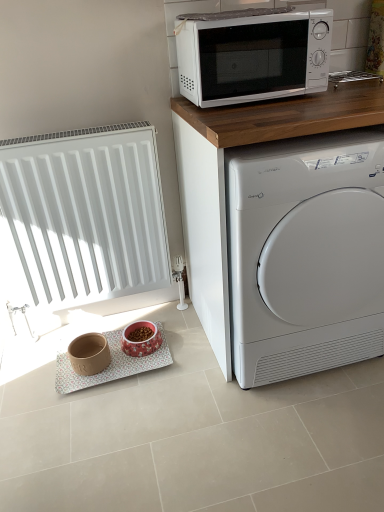
I want to click on free space that is to the left of white glossy washing machine at right, so click(164, 384).